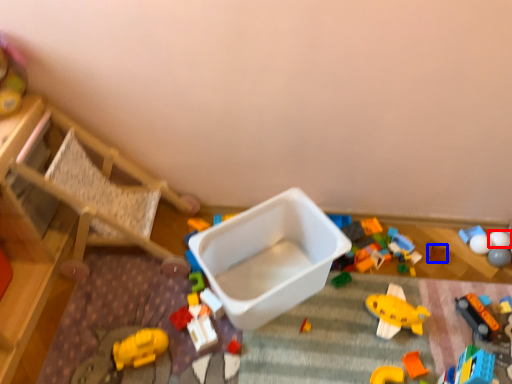
Question: Which of the following is the farthest to the observer, toy (highlighted by a red box) or toy (highlighted by a blue box)?

Choices:
 (A) toy
 (B) toy

Answer: (B)